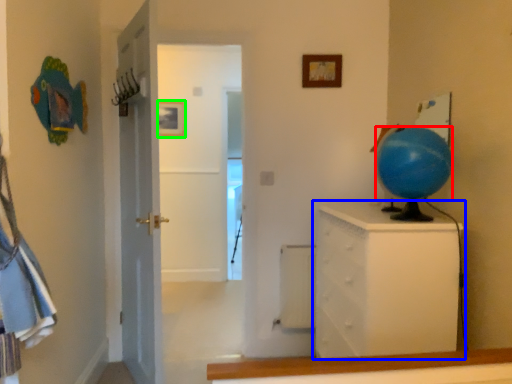
Question: Considering the real-world distances, which object is farthest from balloon (highlighted by a red box)? chest of drawers (highlighted by a blue box) or picture frame (highlighted by a green box)?

Choices:
 (A) chest of drawers
 (B) picture frame

Answer: (B)